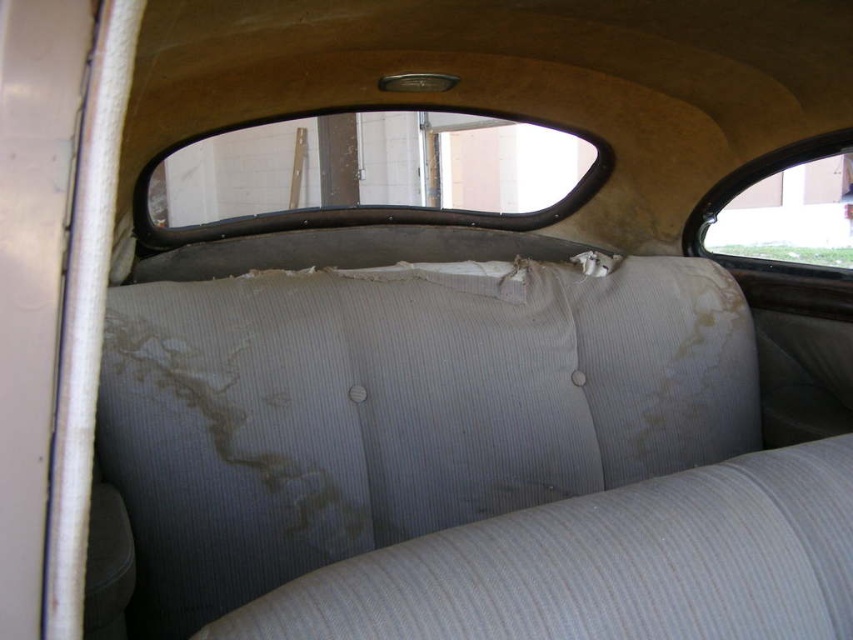
Question: Can you confirm if clear glass window at upper center is positioned below clear glass window at upper right?

Choices:
 (A) no
 (B) yes

Answer: (A)

Question: Does clear glass window at upper center appear over clear glass window at upper right?

Choices:
 (A) no
 (B) yes

Answer: (B)

Question: Which of the following is the farthest from the observer?

Choices:
 (A) (766, 216)
 (B) (305, 196)

Answer: (B)

Question: Is clear glass window at upper center to the left of clear glass window at upper right from the viewer's perspective?

Choices:
 (A) no
 (B) yes

Answer: (B)

Question: Which of the following is the farthest from the observer?

Choices:
 (A) (780, 195)
 (B) (199, 161)

Answer: (A)